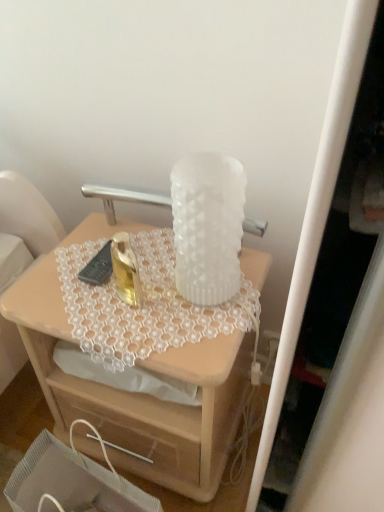
Image resolution: width=384 pixels, height=512 pixels. I want to click on translucent glass vase at upper center, so click(x=139, y=394).

Where is `white frosted vase at center`? white frosted vase at center is located at coordinates (208, 226).

Between wooden drawer at lower center and translucent glass vase at upper center, which one appears on the right side from the viewer's perspective?

translucent glass vase at upper center.

Which object is wider, wooden drawer at lower center or translucent glass vase at upper center?

With larger width is translucent glass vase at upper center.

From the image's perspective, relative to translucent glass vase at upper center, is wooden drawer at lower center above or below?

Clearly, from the image's perspective, wooden drawer at lower center is below translucent glass vase at upper center.

From a real-world perspective, is wooden drawer at lower center positioned under translucent glass vase at upper center based on gravity?

Correct, in the physical world, wooden drawer at lower center is lower than translucent glass vase at upper center.

From a real-world perspective, which object rests below the other?

wooden drawer at lower center is physically lower.

Is wooden drawer at lower center surrounded by white frosted vase at center?

No.

Find the location of a particular element. This screenshot has width=384, height=512. drawer below the white frosted vase at center (from a real-world perspective) is located at coordinates (133, 428).

Is translucent glass vase at upper center not near wooden drawer at lower center?

No, translucent glass vase at upper center is in close proximity to wooden drawer at lower center.

How many degrees apart are the facing directions of translucent glass vase at upper center and wooden drawer at lower center?

translucent glass vase at upper center and wooden drawer at lower center are facing 1.5 degrees away from each other.

Which is closer, (216, 339) or (96, 458)?

Point (216, 339)

From a real-world perspective, relative to wooden drawer at lower center, is translucent glass vase at upper center vertically above or below?

translucent glass vase at upper center is situated higher than wooden drawer at lower center in the real world.

Is point (124, 407) in front of point (173, 200)?

No, it is behind (173, 200).

What are the coordinates of `vase that appears above the wooden drawer at lower center (from a real-world perspective)` in the screenshot? It's located at (208, 226).

What's the angular difference between wooden drawer at lower center and white frosted vase at center's facing directions?

The angle between the facing direction of wooden drawer at lower center and the facing direction of white frosted vase at center is 2.27 degrees.

Which is further, (25, 301) or (185, 206)?

The point (25, 301) is farther from the camera.

Which object is more forward, translucent glass vase at upper center or white frosted vase at center?

Positioned in front is white frosted vase at center.

How different are the orientations of translucent glass vase at upper center and white frosted vase at center in degrees?

translucent glass vase at upper center and white frosted vase at center are facing 0.773 degrees away from each other.

Is translucent glass vase at upper center not close to white frosted vase at center?

No, translucent glass vase at upper center is not far from white frosted vase at center.

Which object is closer to the camera, white frosted vase at center or translucent glass vase at upper center?

white frosted vase at center is in front.

Is white frosted vase at center aimed at translucent glass vase at upper center?

No, white frosted vase at center is not oriented towards translucent glass vase at upper center.

Does white frosted vase at center have a greater width compared to translucent glass vase at upper center?

No.

The height and width of the screenshot is (512, 384). In order to click on desk behind the wooden drawer at lower center in this screenshot , I will do click(x=139, y=394).

Where is `drawer below the white frosted vase at center (from a real-world perspective)`? This screenshot has height=512, width=384. drawer below the white frosted vase at center (from a real-world perspective) is located at coordinates (133, 428).

From the image, which object appears to be nearer to translucent glass vase at upper center, wooden drawer at lower center or white frosted vase at center?

wooden drawer at lower center is positioned closer to the anchor translucent glass vase at upper center.

Based on their spatial positions, is wooden drawer at lower center or translucent glass vase at upper center closer to white frosted vase at center?

translucent glass vase at upper center lies closer to white frosted vase at center than the other object.

Based on their spatial positions, is translucent glass vase at upper center or wooden drawer at lower center further from white frosted vase at center?

The object further to white frosted vase at center is wooden drawer at lower center.

When comparing their distances from wooden drawer at lower center, does white frosted vase at center or translucent glass vase at upper center seem closer?

Based on the image, translucent glass vase at upper center appears to be nearer to wooden drawer at lower center.

Which object lies further to the anchor point wooden drawer at lower center, translucent glass vase at upper center or white frosted vase at center?

Among the two, white frosted vase at center is located further to wooden drawer at lower center.

From the image, which object appears to be farther from translucent glass vase at upper center, white frosted vase at center or wooden drawer at lower center?

Among the two, white frosted vase at center is located further to translucent glass vase at upper center.

Locate an element on the screen. The width and height of the screenshot is (384, 512). desk between white frosted vase at center and wooden drawer at lower center from top to bottom is located at coordinates (139, 394).